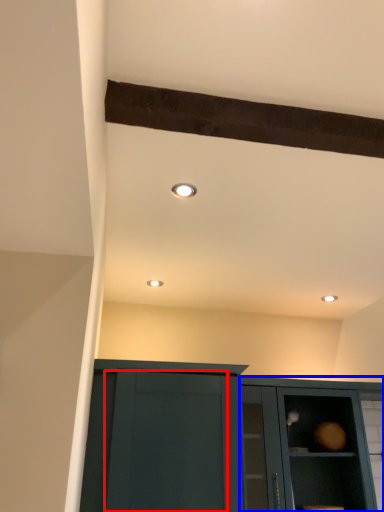
Question: Which of the following is the closest to the observer, glass door (highlighted by a red box) or cabinetry (highlighted by a blue box)?

Choices:
 (A) glass door
 (B) cabinetry

Answer: (A)